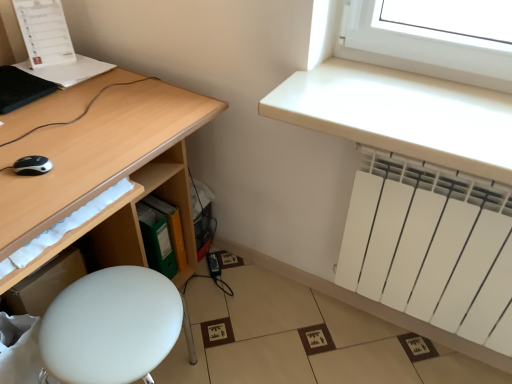
Find the location of `vacant area that lies to the right of white matte stool at lower left`. vacant area that lies to the right of white matte stool at lower left is located at coordinates click(260, 353).